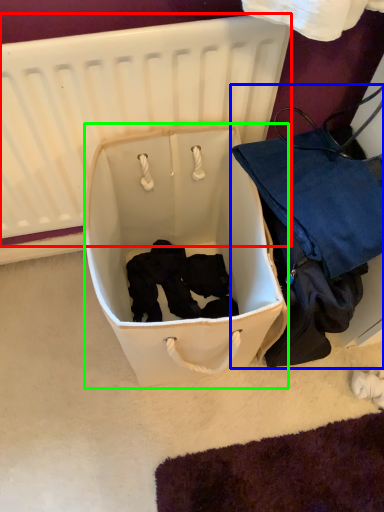
Question: Which object is the farthest from infant bed (highlighted by a red box)? Choose among these: luggage and bags (highlighted by a blue box) or storage box (highlighted by a green box).

Choices:
 (A) luggage and bags
 (B) storage box

Answer: (A)